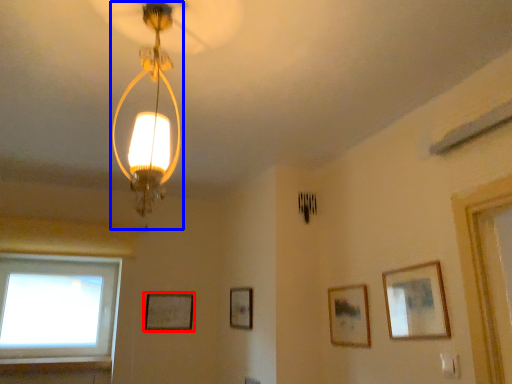
Question: Which point is closer to the camera, picture frame (highlighted by a red box) or lamp (highlighted by a blue box)?

Choices:
 (A) picture frame
 (B) lamp

Answer: (B)